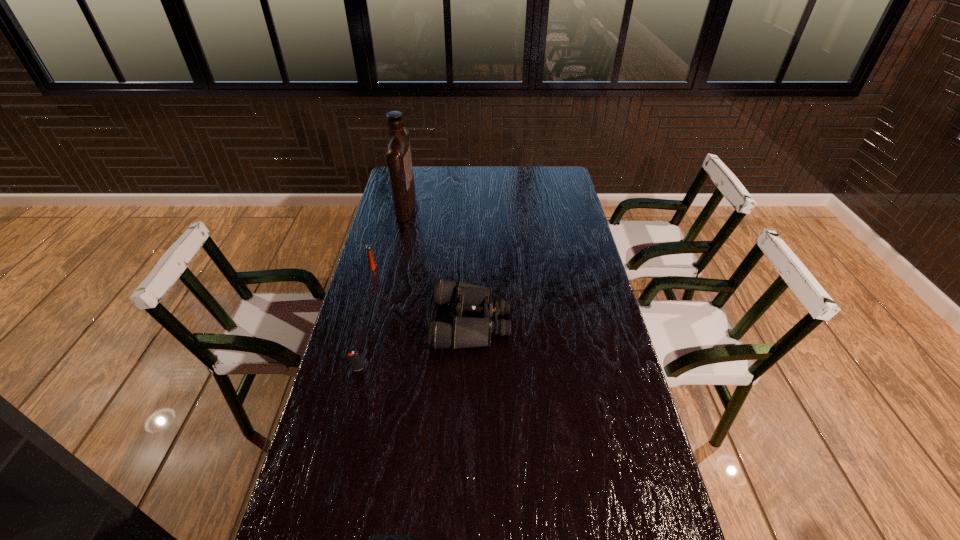
At what (x,y) coordinates should I click in order to perform the action: click on liquor. Please return your answer as a coordinate pair (x, y). This screenshot has width=960, height=540. Looking at the image, I should click on (399, 160).

This screenshot has width=960, height=540. In order to click on the farthest object in this screenshot , I will do `click(399, 160)`.

Locate an element on the screen. the fourth shortest object is located at coordinates (368, 247).

Find the location of a particular element. This screenshot has width=960, height=540. the farther igniter is located at coordinates (368, 247).

Identify the location of binoculars. The image size is (960, 540). (465, 332).

Find the location of `the right igniter`. the right igniter is located at coordinates (354, 358).

This screenshot has height=540, width=960. I want to click on the second nearest object, so click(x=354, y=358).

Where is `vacant space positioned 0.300m on the label side of the liquor`? The height and width of the screenshot is (540, 960). vacant space positioned 0.300m on the label side of the liquor is located at coordinates (483, 206).

Identify the location of free space located on the right of the fourth nearest object. (475, 267).

The width and height of the screenshot is (960, 540). Identify the location of vacant position located 0.250m through the eyepieces of the binoculars. (587, 322).